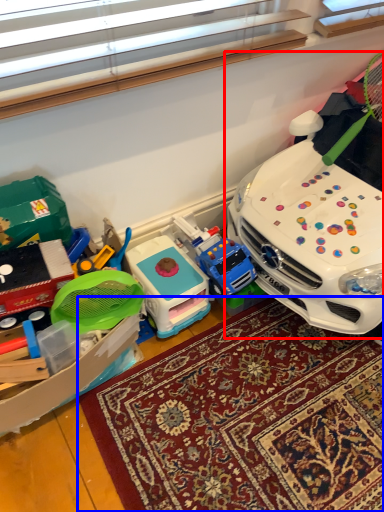
Question: Which object is further to the camera taking this photo, toy (highlighted by a red box) or mat (highlighted by a blue box)?

Choices:
 (A) toy
 (B) mat

Answer: (B)